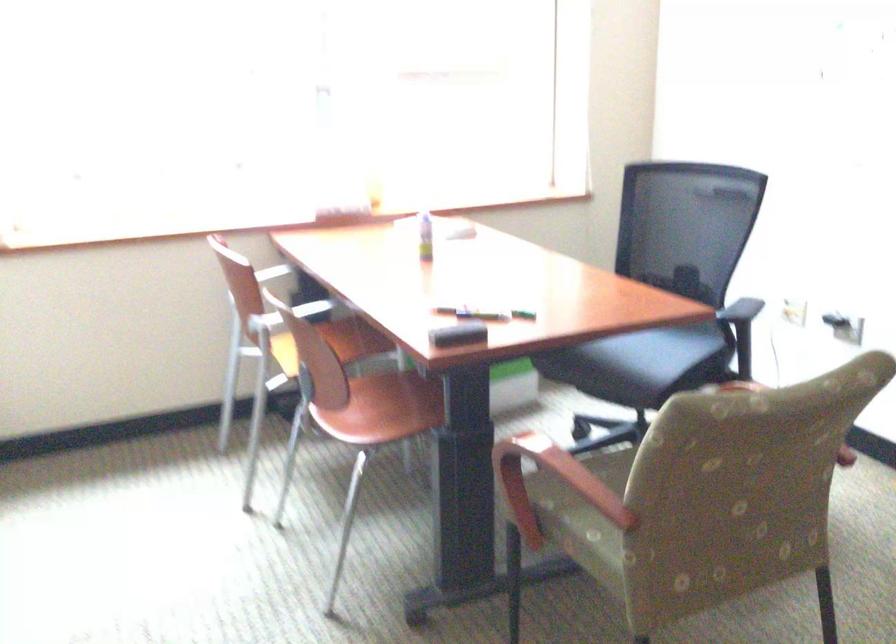
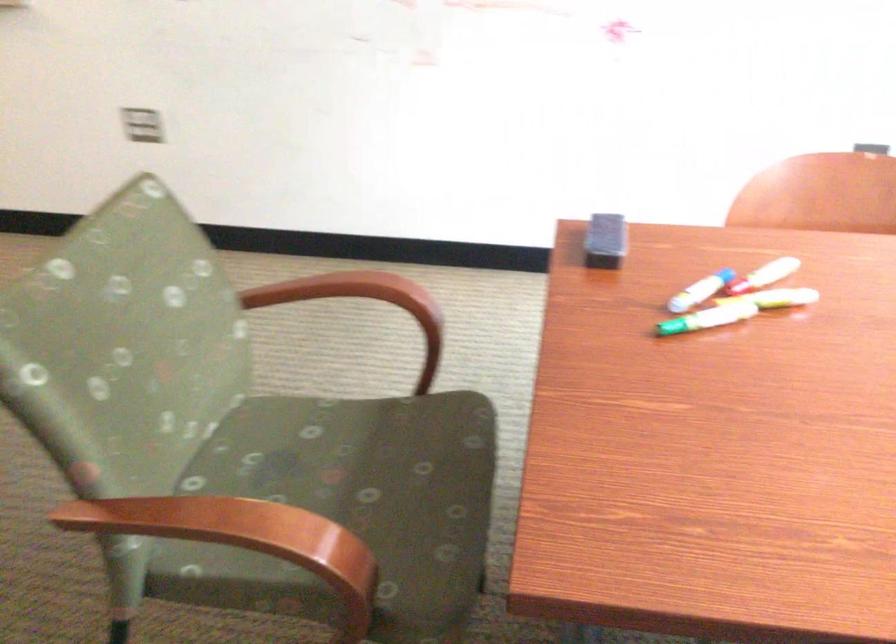
The point at (522, 313) is marked in the first image. Where is the corresponding point in the second image?

(675, 327)